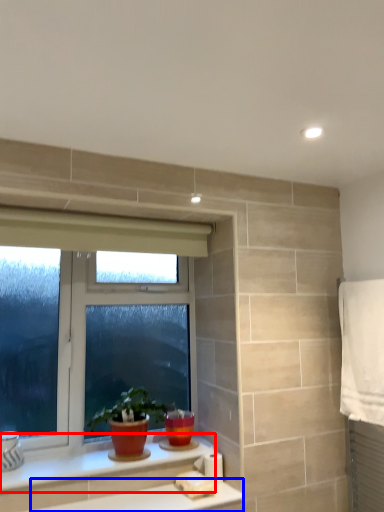
Question: Which of the following is the farthest to the observer, counter top (highlighted by a red box) or counter top (highlighted by a blue box)?

Choices:
 (A) counter top
 (B) counter top

Answer: (A)